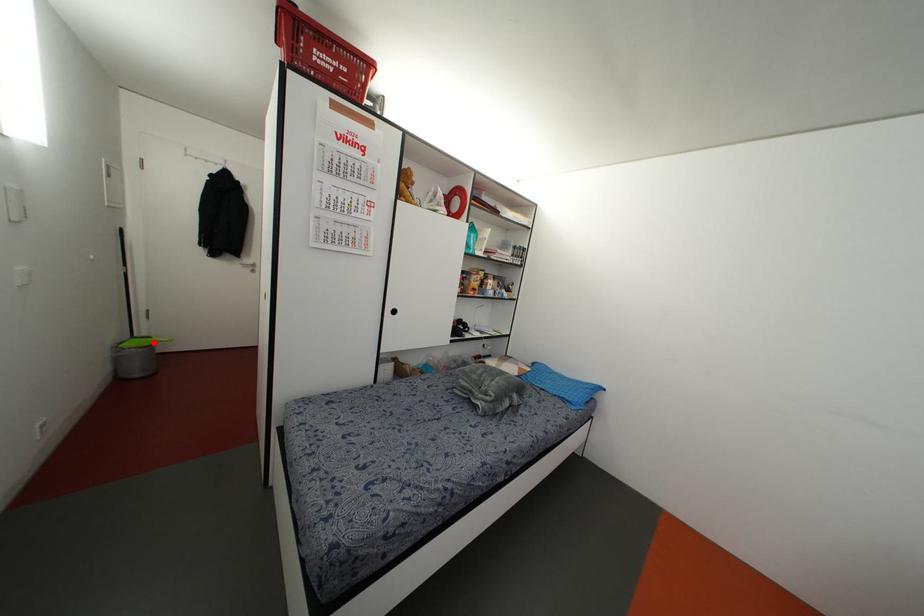
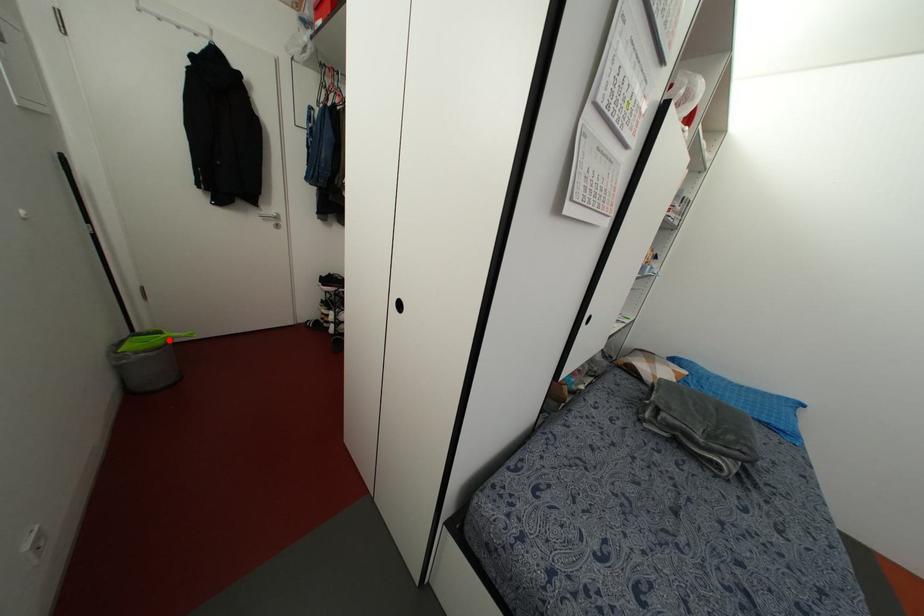
I am providing you with two images of the same scene from different viewpoints. A red point is marked on the first image and another point is marked on the second image. Is the marked point in image1 the same physical position as the marked point in image2?

Yes